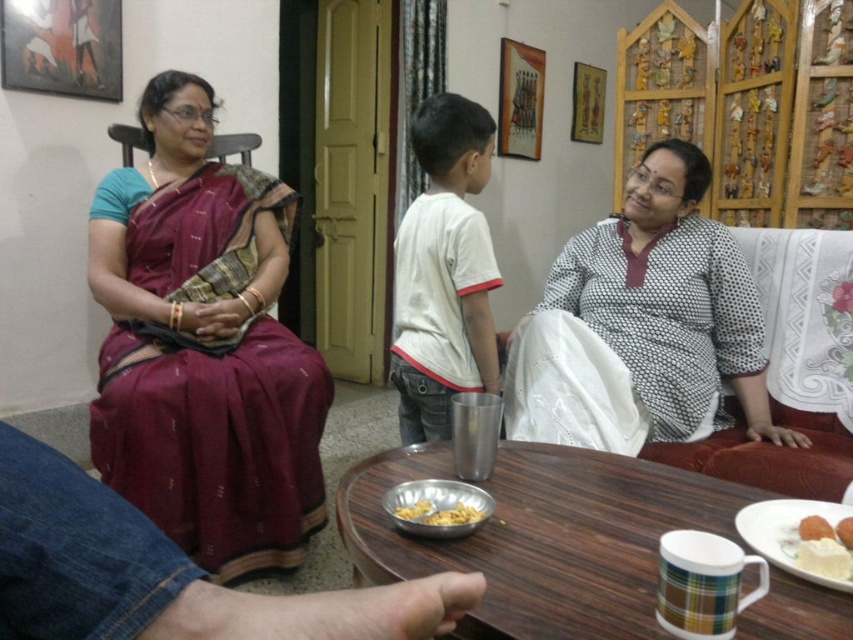
You are standing in the living room and want to reach the point marked at coordinates [260,316]. If your average walking speed is 3 feet per second, how many seconds will it take you to reach that point?

The distance between you and the point marked at coordinates [260,316] is 7.03 feet. At a speed of 3 feet per second, it would take approximately 2.34 seconds to reach the point.

You are standing in the living room and see two points marked on the wall. The first point is at coordinate point (432, 506) and the second is at point (828, 525). Which point is closer to you?

Point (432, 506) is closer to you because it is further to the viewer than point (828, 525).